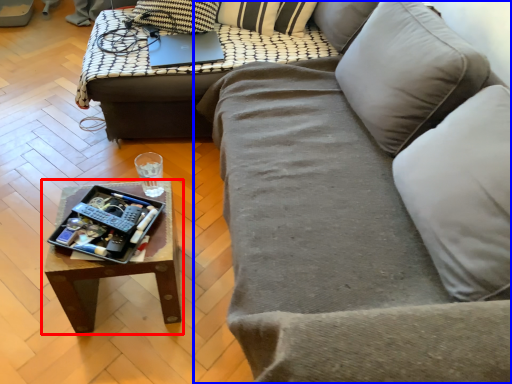
Question: Which object appears closest to the camera in this image, coffee table (highlighted by a red box) or studio couch (highlighted by a blue box)?

Choices:
 (A) coffee table
 (B) studio couch

Answer: (B)